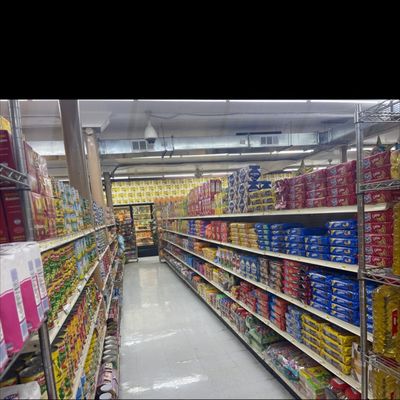
Identify the location of air ducts. (182, 144).